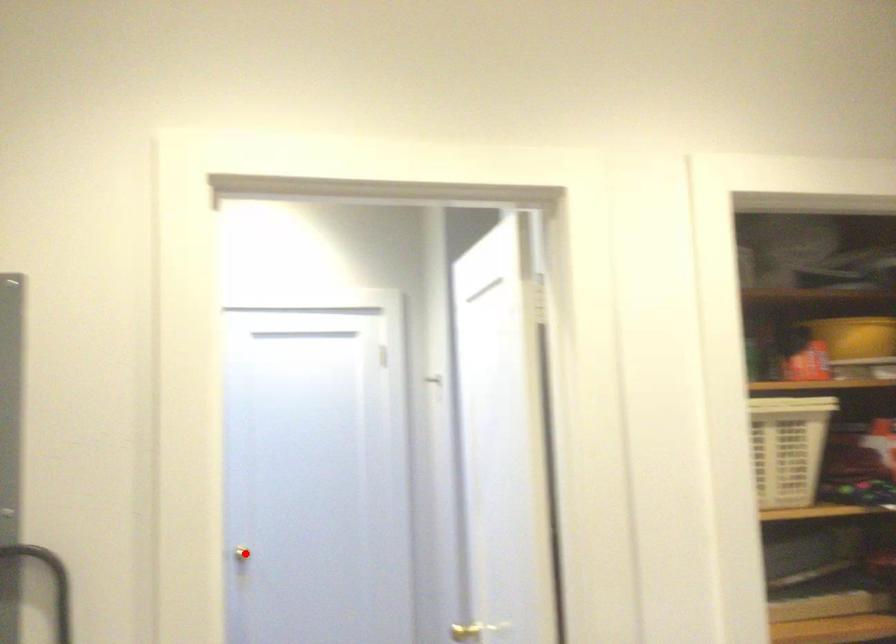
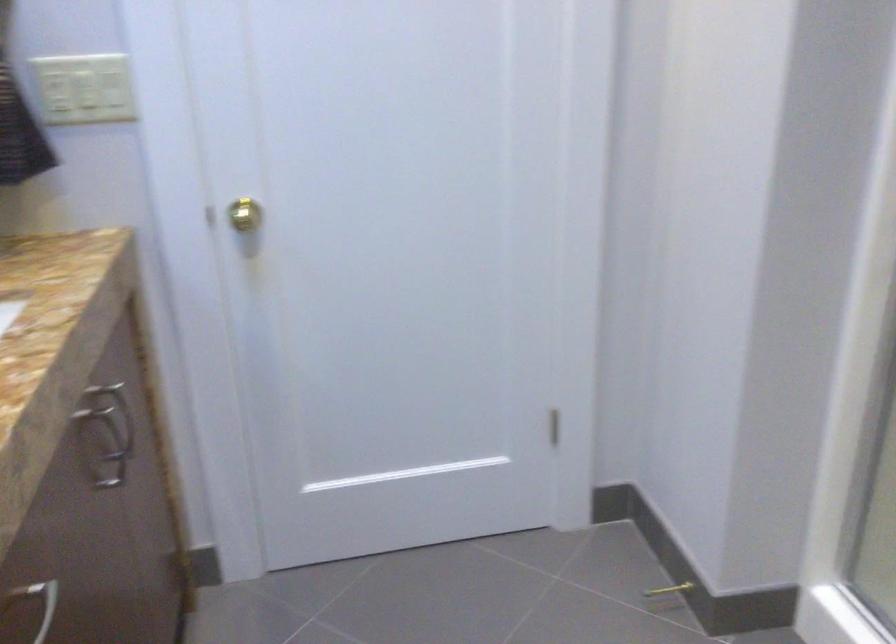
The point at the highlighted location is marked in the first image. Where is the corresponding point in the second image?

(240, 214)